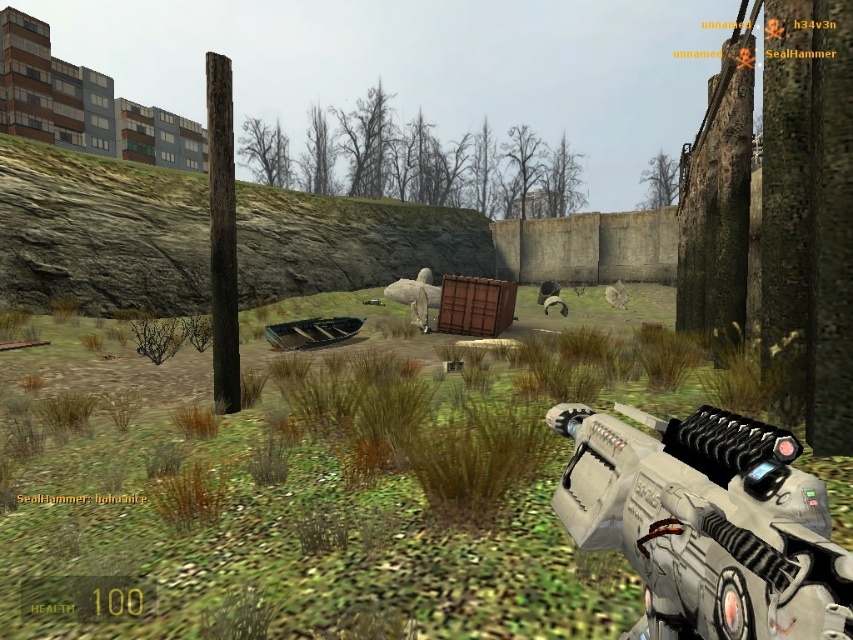
Does metallic silver gun at lower right have a smaller size compared to furry gray animal at center?

Yes.

Who is positioned more to the left, metallic silver gun at lower right or furry gray animal at center?

metallic silver gun at lower right is more to the left.

The image size is (853, 640). What do you see at coordinates (706, 524) in the screenshot?
I see `metallic silver gun at lower right` at bounding box center [706, 524].

At what (x,y) coordinates should I click in order to perform the action: click on metallic silver gun at lower right. Please return your answer as a coordinate pair (x, y). The image size is (853, 640). Looking at the image, I should click on [706, 524].